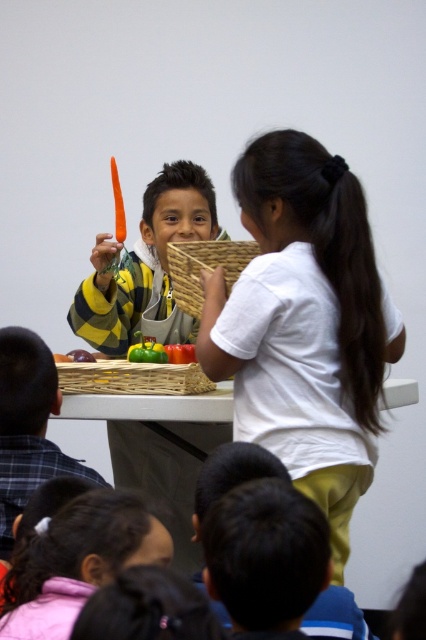
Question: Among these points, which one is farthest from the camera?

Choices:
 (A) (95, 374)
 (B) (250, 248)
 (C) (118, 204)
 (D) (236, 376)

Answer: (C)

Question: Considering the relative positions of white matte shirt at upper center and woven bamboo tray at center in the image provided, where is white matte shirt at upper center located with respect to woven bamboo tray at center?

Choices:
 (A) below
 (B) above

Answer: (B)

Question: Can you confirm if matte yellow apron at center is thinner than yellow-green striped shirt at center?

Choices:
 (A) yes
 (B) no

Answer: (B)

Question: Among these points, which one is nearest to the camera?

Choices:
 (A) (224, 307)
 (B) (195, 316)
 (C) (178, 342)

Answer: (A)

Question: Does matte yellow apron at center appear on the left side of green matte bell pepper at center?

Choices:
 (A) yes
 (B) no

Answer: (A)

Question: Which point is closer to the camera?

Choices:
 (A) (16, 506)
 (B) (181, 348)
 (C) (371, 326)

Answer: (A)